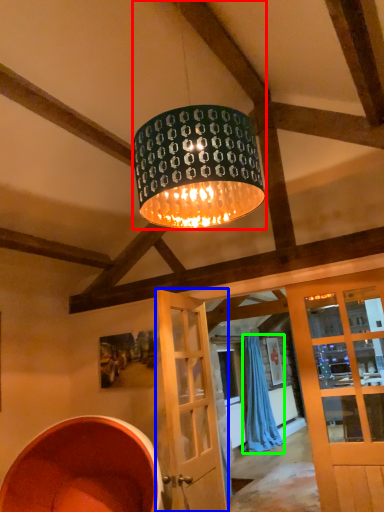
Question: Considering the real-world distances, which object is farthest from lamp (highlighted by a red box)? door (highlighted by a blue box) or curtain (highlighted by a green box)?

Choices:
 (A) door
 (B) curtain

Answer: (B)